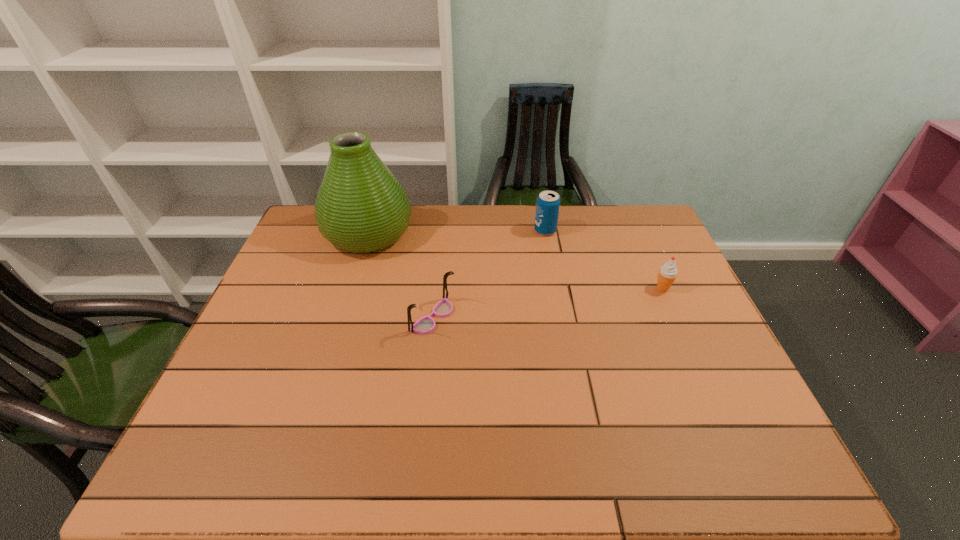
The height and width of the screenshot is (540, 960). I want to click on vacant space at the far left corner of the desktop, so click(306, 228).

The image size is (960, 540). Find the location of `vacant space at the far right corner of the desktop`. vacant space at the far right corner of the desktop is located at coordinates (626, 212).

Where is `unoccupied position between the spectacles and the soda can`? The width and height of the screenshot is (960, 540). unoccupied position between the spectacles and the soda can is located at coordinates (489, 274).

Where is `free area in between the icecream and the nearest object`? Image resolution: width=960 pixels, height=540 pixels. free area in between the icecream and the nearest object is located at coordinates (547, 303).

The image size is (960, 540). Find the location of `free space between the soda can and the tallest object`. free space between the soda can and the tallest object is located at coordinates (457, 232).

This screenshot has height=540, width=960. Identify the location of free space between the tallest object and the third object from left to right. (457, 232).

Where is `unoccupied position between the vase and the third farthest object`? unoccupied position between the vase and the third farthest object is located at coordinates (516, 261).

Locate an element on the screen. free spot between the leftmost object and the spectacles is located at coordinates (400, 276).

You are a GUI agent. You are given a task and a screenshot of the screen. Output one action in this format:
    pyautogui.click(x=<x>, y=<y>)
    Task: Click on the free space between the soda can and the third object from right to left
    The width and height of the screenshot is (960, 540).
    Given the screenshot: What is the action you would take?
    pyautogui.click(x=489, y=274)

You are a GUI agent. You are given a task and a screenshot of the screen. Output one action in this format:
    pyautogui.click(x=<x>, y=<y>)
    Task: Click on the blank region between the second object from right to left and the second object from left to right
    This screenshot has width=960, height=540.
    Given the screenshot: What is the action you would take?
    pyautogui.click(x=489, y=274)